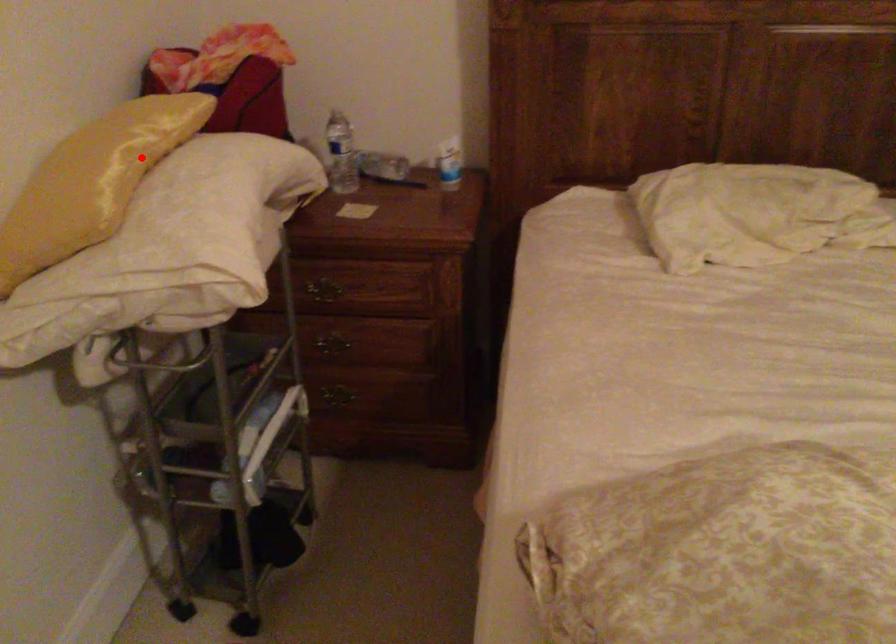
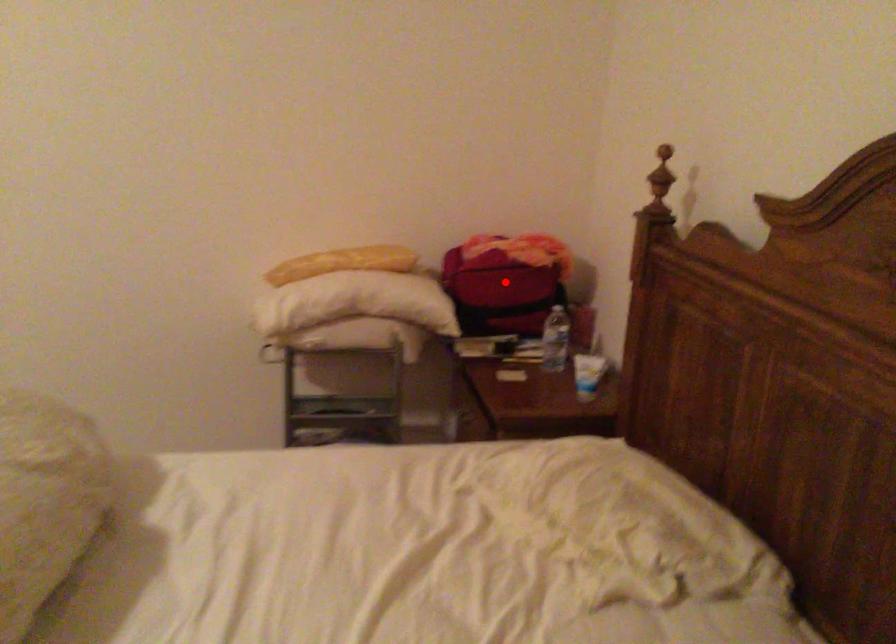
I am providing you with two images of the same scene from different viewpoints. A red point is marked on the first image and another point is marked on the second image. Does the point marked in image1 correspond to the same location as the one in image2?

No